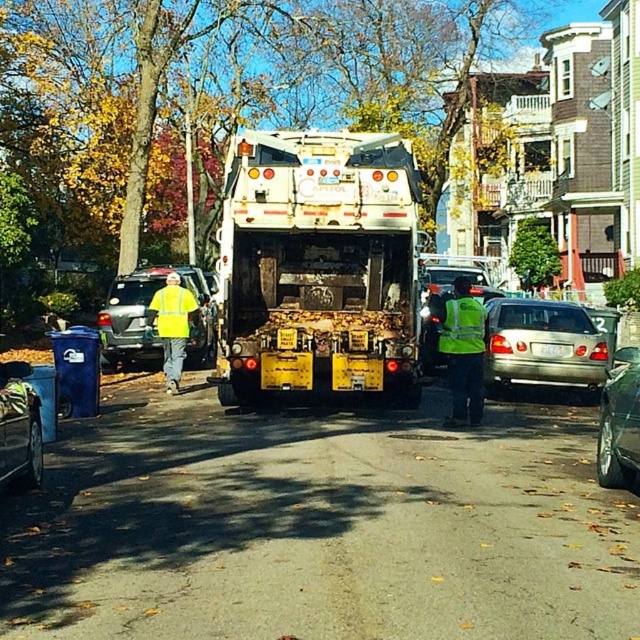
Question: Is the position of silver metallic sedan at center more distant than that of shiny metallic car at right?

Choices:
 (A) no
 (B) yes

Answer: (B)

Question: Is high-visibility yellow vest at center smaller than high-visibility fabric safety vest at center-right?

Choices:
 (A) no
 (B) yes

Answer: (A)

Question: Which object appears closest to the camera in this image?

Choices:
 (A) yellow reflective vest at left
 (B) white matte garbage truck at center
 (C) blue plastic trash can at left
 (D) yellow reflective safety vest at left

Answer: (B)

Question: Which of the following is the farthest from the observer?

Choices:
 (A) white matte garbage truck at center
 (B) yellow reflective vest at left
 (C) high-visibility fabric safety vest at center-right
 (D) silver metallic sedan at center

Answer: (B)

Question: Which point appears closest to the camera in this image?

Choices:
 (A) (484, 308)
 (B) (125, 323)

Answer: (A)

Question: Where is high-visibility yellow vest at center located in relation to yellow reflective safety vest at left in the image?

Choices:
 (A) below
 (B) above

Answer: (A)